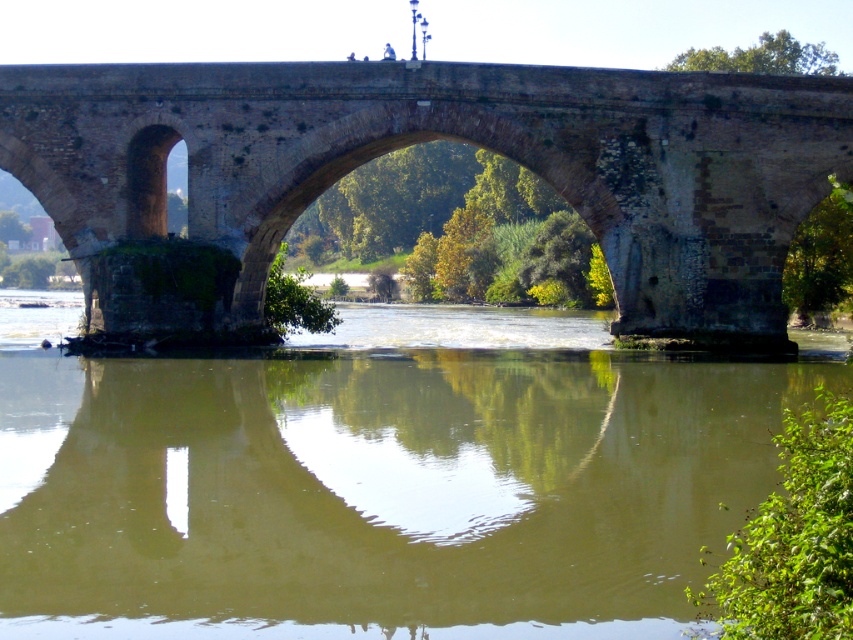
Question: In this image, where is greenish-brown water at center located relative to brown stone bridge at center?

Choices:
 (A) left
 (B) right

Answer: (B)

Question: Can you confirm if greenish-brown water at center is positioned above brown stone bridge at center?

Choices:
 (A) yes
 (B) no

Answer: (B)

Question: Does greenish-brown water at center appear under brown stone bridge at center?

Choices:
 (A) no
 (B) yes

Answer: (B)

Question: Which point is closer to the camera taking this photo?

Choices:
 (A) (433, 413)
 (B) (245, 102)

Answer: (A)